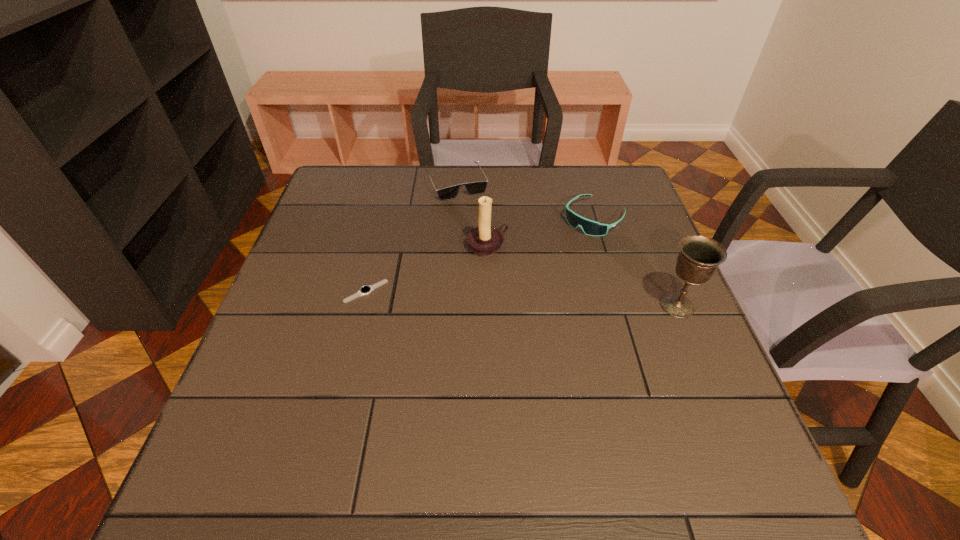
Where is `the fourth closest object relative to the chalice`? The width and height of the screenshot is (960, 540). the fourth closest object relative to the chalice is located at coordinates click(x=364, y=290).

Image resolution: width=960 pixels, height=540 pixels. Find the location of `object that stands as the second closest to the chalice`. object that stands as the second closest to the chalice is located at coordinates (484, 241).

Where is `free space that satisfies the following two spatial constraints: 1. on the front side of the right sunglasses; 2. on the right side of the chalice`? The image size is (960, 540). free space that satisfies the following two spatial constraints: 1. on the front side of the right sunglasses; 2. on the right side of the chalice is located at coordinates (620, 306).